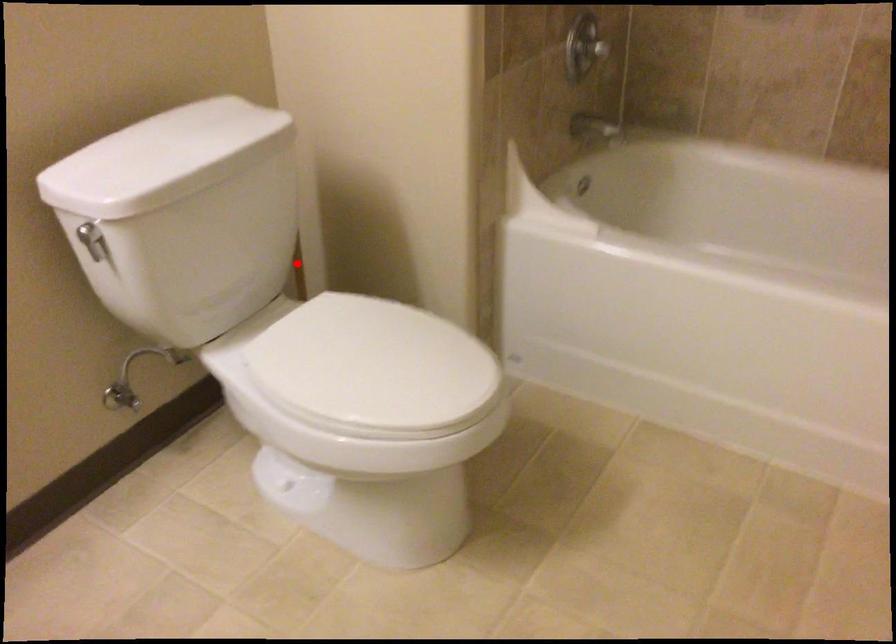
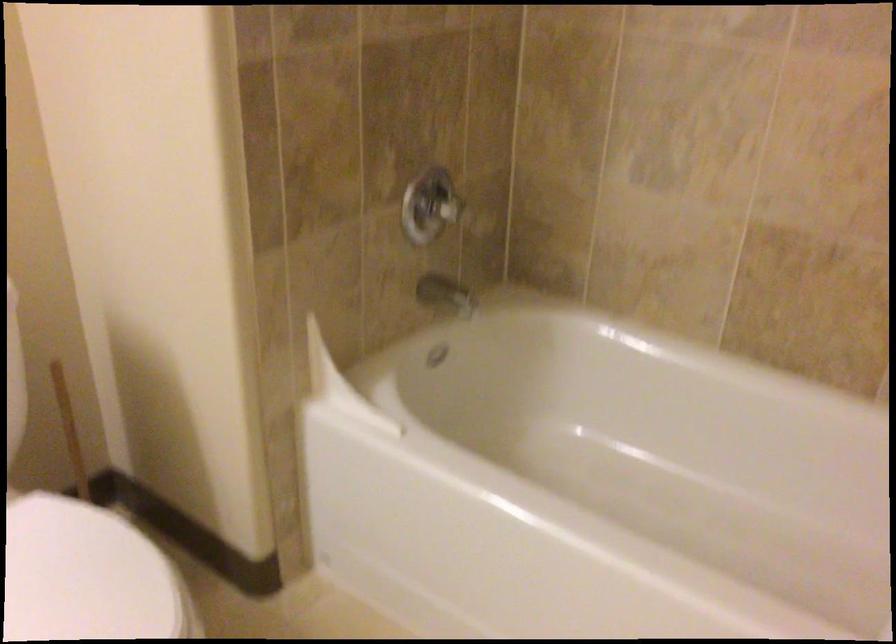
Question: A red point is marked in image1. In image2, is the corresponding 3D point closer to the camera or farther? Reply with the corresponding letter.

Choices:
 (A) The corresponding 3D point is closer.
 (B) The corresponding 3D point is farther.

Answer: (A)